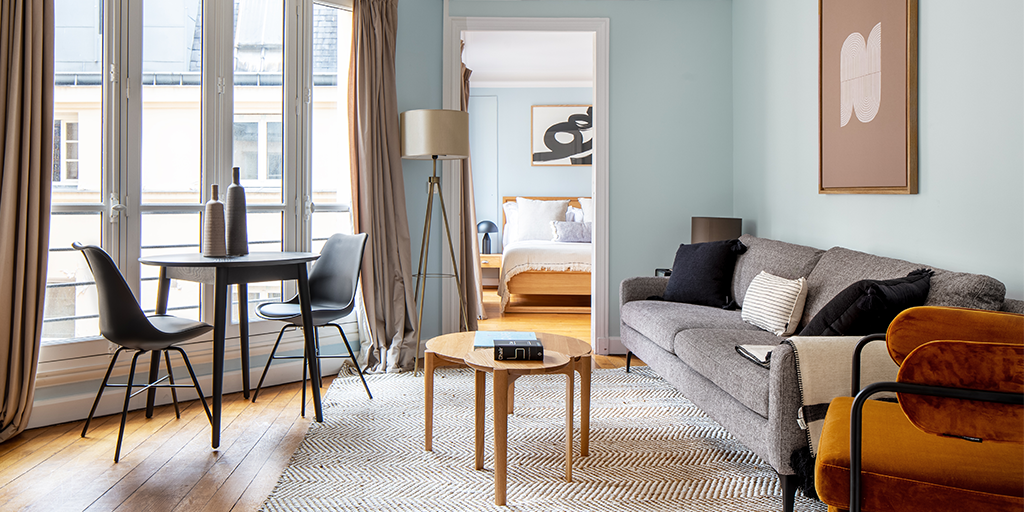
Where is `jugs`? The image size is (1024, 512). jugs is located at coordinates (238, 190), (207, 225).